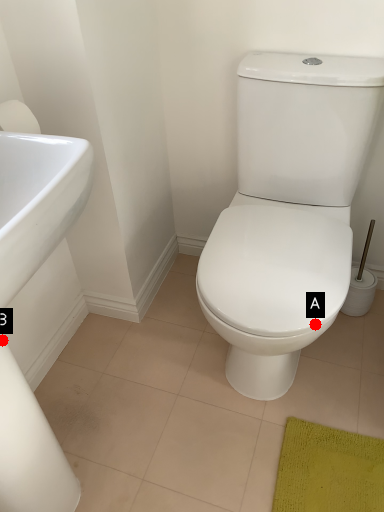
Question: Two points are circled on the image, labeled by A and B beside each circle. Among these points, which one is farthest from the camera?

Choices:
 (A) A is further
 (B) B is further

Answer: (A)